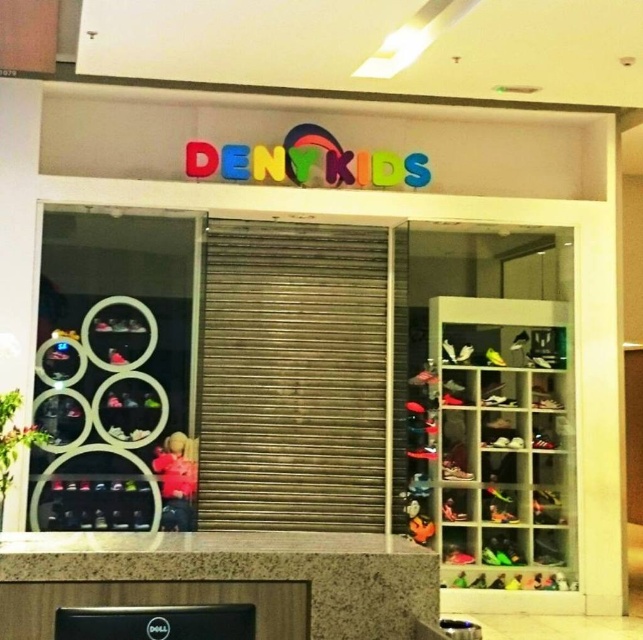
Question: Does shiny plastic shoes at right have a larger size compared to pink fabric doll at center?

Choices:
 (A) yes
 (B) no

Answer: (A)

Question: Considering the relative positions of shiny plastic shoes at right and pink fabric doll at center in the image provided, where is shiny plastic shoes at right located with respect to pink fabric doll at center?

Choices:
 (A) below
 (B) above

Answer: (B)

Question: Does shiny plastic shoes at right have a greater width compared to pink fabric doll at center?

Choices:
 (A) yes
 (B) no

Answer: (A)

Question: Which object appears closest to the camera in this image?

Choices:
 (A) pink fabric doll at center
 (B) shiny plastic shoes at right

Answer: (A)

Question: Which point is closer to the camera taking this photo?

Choices:
 (A) (161, 529)
 (B) (413, 502)

Answer: (A)